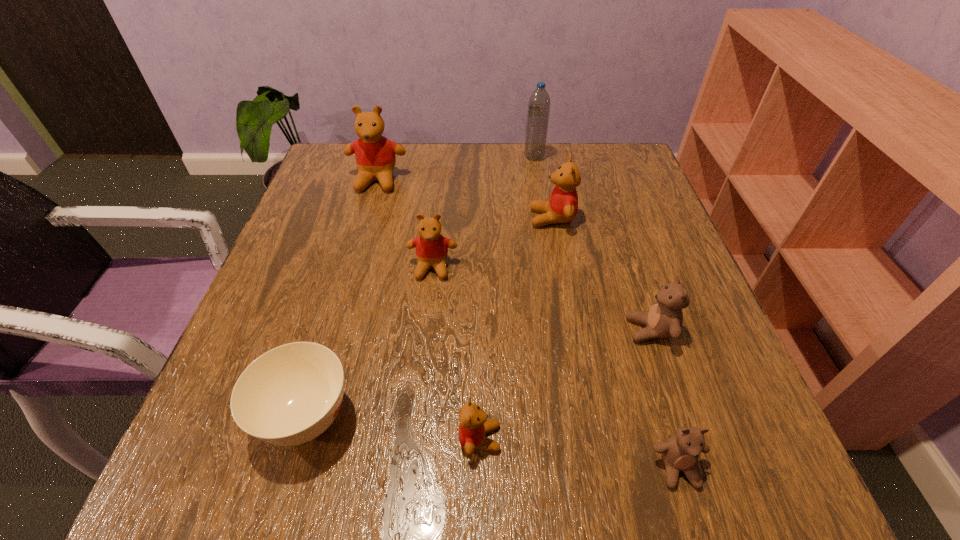
Image resolution: width=960 pixels, height=540 pixels. I want to click on vacant position located on the front-facing side of the fifth farthest object, so click(x=485, y=330).

Locate an element on the screen. The width and height of the screenshot is (960, 540). vacant area situated on the front-facing side of the fifth farthest object is located at coordinates (577, 330).

Where is `vacant space located on the front-facing side of the fifth farthest object`? This screenshot has height=540, width=960. vacant space located on the front-facing side of the fifth farthest object is located at coordinates (542, 330).

Image resolution: width=960 pixels, height=540 pixels. In order to click on free region located 0.330m on the back of the sugar bowl in this screenshot , I will do `click(358, 240)`.

Locate an element on the screen. This screenshot has width=960, height=540. free space located 0.060m on the front-facing side of the fifth object from right to left is located at coordinates (541, 438).

Where is `water bottle present at the far edge`? water bottle present at the far edge is located at coordinates (539, 102).

The height and width of the screenshot is (540, 960). Find the location of `teddy bear that is at the far edge`. teddy bear that is at the far edge is located at coordinates (375, 155).

You are a GUI agent. You are given a task and a screenshot of the screen. Output one action in this format:
    pyautogui.click(x=<x>, y=<y>)
    Task: Click on the sugar bowl that is at the near edge
    
    Given the screenshot: What is the action you would take?
    pyautogui.click(x=291, y=394)

Identify the location of teddy bear that is at the left edge. (375, 155).

Where is `sugar bowl present at the left edge`? sugar bowl present at the left edge is located at coordinates (291, 394).